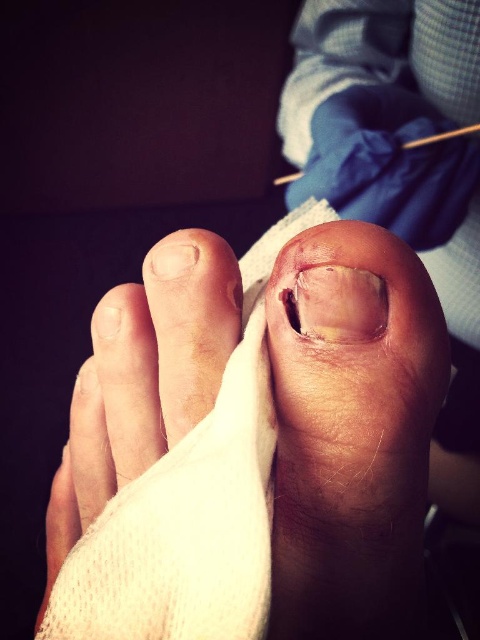
You are a nurse assessing a patient with an injured toe. You notice the yellowish skin at center and the white fabric bandage at center. Which object is larger in size?

The white fabric bandage at center is larger than the yellowish skin at center.

You are a medical professional holding a tool that is 20 centimeters long. You need to reach the point marked at coordinates point (355, 449). Can your tool reach that point?

The distance between the point (355, 449) and the viewer is 25.95 centimeters. Since the tool is only 20 centimeters long, it cannot reach the point.

You are a nurse in a clinic. You need to apply a new bandage to the yellowish translucent nail at center. The existing white fabric bandage at center is in the way. Can you slide the new bandage between them without touching the nail?

The white fabric bandage at center and yellowish translucent nail at center are 3.35 inches apart. Since the distance is sufficient, you can slide the new bandage between them without touching the nail.